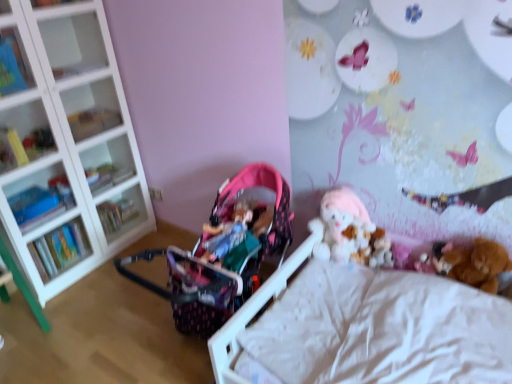
Question: Can you confirm if pink fabric baby carriage at center is thinner than clear glass shelves at left, the fourth shelf in the top-to-bottom sequence?

Choices:
 (A) no
 (B) yes

Answer: (A)

Question: From the image's perspective, would you say pink fabric baby carriage at center is shown under clear glass shelves at left, which ranks as the 2th shelf in bottom-to-top order?

Choices:
 (A) no
 (B) yes

Answer: (B)

Question: From a real-world perspective, does pink fabric baby carriage at center sit lower than clear glass shelves at left, the fourth shelf in the top-to-bottom sequence?

Choices:
 (A) yes
 (B) no

Answer: (A)

Question: From the image's perspective, is pink fabric baby carriage at center over clear glass shelves at left, which ranks as the 2th shelf in bottom-to-top order?

Choices:
 (A) no
 (B) yes

Answer: (A)

Question: Is pink fabric baby carriage at center to the right of clear glass shelves at left, which ranks as the 2th shelf in bottom-to-top order, from the viewer's perspective?

Choices:
 (A) yes
 (B) no

Answer: (A)

Question: From a real-world perspective, is matte plastic shelf at upper left, the first shelf viewed from the top, physically located above or below pink fabric baby carriage at center?

Choices:
 (A) below
 (B) above

Answer: (B)

Question: In terms of width, does matte plastic shelf at upper left, the first shelf viewed from the top, look wider or thinner when compared to pink fabric baby carriage at center?

Choices:
 (A) wide
 (B) thin

Answer: (B)

Question: Based on their positions, is matte plastic shelf at upper left, which is counted as the fifth shelf, starting from the bottom, located to the left or right of pink fabric baby carriage at center?

Choices:
 (A) right
 (B) left

Answer: (B)

Question: Is point (18, 34) closer or farther from the camera than point (200, 241)?

Choices:
 (A) closer
 (B) farther

Answer: (B)

Question: In the image, is white glass shelf at left, the third shelf ordered from the bottom, positioned in front of or behind fuzzy brown teddy bear at lower right, marked as the 2th toy in a right-to-left arrangement?

Choices:
 (A) behind
 (B) front

Answer: (A)

Question: From their relative heights in the image, would you say white glass shelf at left, the third shelf ordered from the bottom, is taller or shorter than fuzzy brown teddy bear at lower right, marked as the 2th toy in a right-to-left arrangement?

Choices:
 (A) short
 (B) tall

Answer: (B)

Question: Is white glass shelf at left, the third shelf ordered from the bottom, inside or outside of fuzzy brown teddy bear at lower right, the second toy from the left?

Choices:
 (A) inside
 (B) outside

Answer: (B)

Question: From the image's perspective, is white glass shelf at left, positioned as the 3th shelf in top-to-bottom order, above or below fuzzy brown teddy bear at lower right, the second toy from the left?

Choices:
 (A) below
 (B) above

Answer: (B)

Question: Does point (1, 87) appear closer or farther from the camera than point (460, 269)?

Choices:
 (A) closer
 (B) farther

Answer: (B)

Question: Considering the relative positions of matte plastic shelf at upper left, the first shelf viewed from the top, and brown plush bear at lower right, which is counted as the first toy, starting from the right, in the image provided, is matte plastic shelf at upper left, the first shelf viewed from the top, to the left or to the right of brown plush bear at lower right, which is counted as the first toy, starting from the right,?

Choices:
 (A) left
 (B) right

Answer: (A)